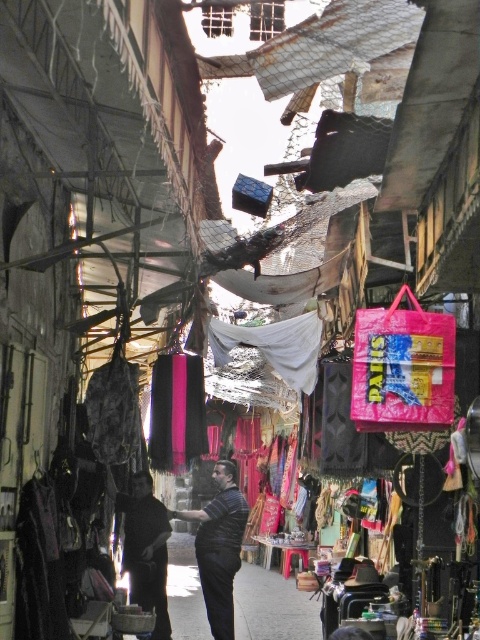
Question: Among these points, which one is nearest to the camera?

Choices:
 (A) (147, 572)
 (B) (233, 556)

Answer: (B)

Question: Is striped fabric shirt at center below dark fabric bag at center?

Choices:
 (A) yes
 (B) no

Answer: (A)

Question: Can you confirm if striped fabric shirt at center is positioned to the left of dark fabric bag at center?

Choices:
 (A) yes
 (B) no

Answer: (B)

Question: Does striped fabric shirt at center have a larger size compared to dark fabric bag at center?

Choices:
 (A) yes
 (B) no

Answer: (A)